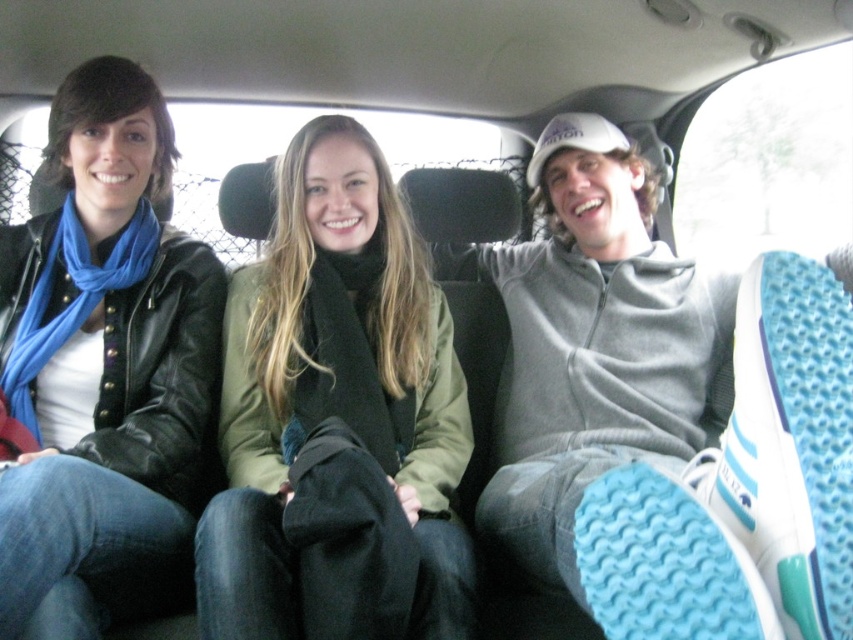
Does green matte jacket at center have a greater height compared to matte black jacket at left?

In fact, green matte jacket at center may be shorter than matte black jacket at left.

Is point (387, 564) farther from camera compared to point (144, 189)?

No, it is not.

This screenshot has width=853, height=640. Identify the location of green matte jacket at center. (338, 419).